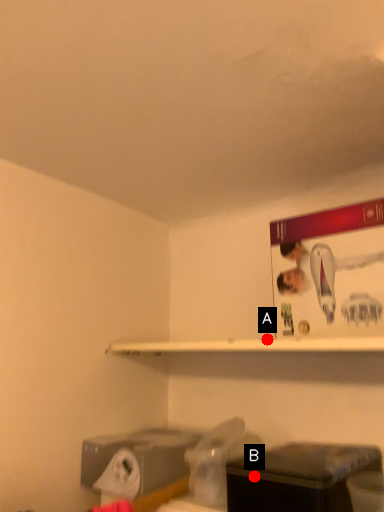
Question: Two points are circled on the image, labeled by A and B beside each circle. Which point is further to the camera?

Choices:
 (A) A is further
 (B) B is further

Answer: (A)